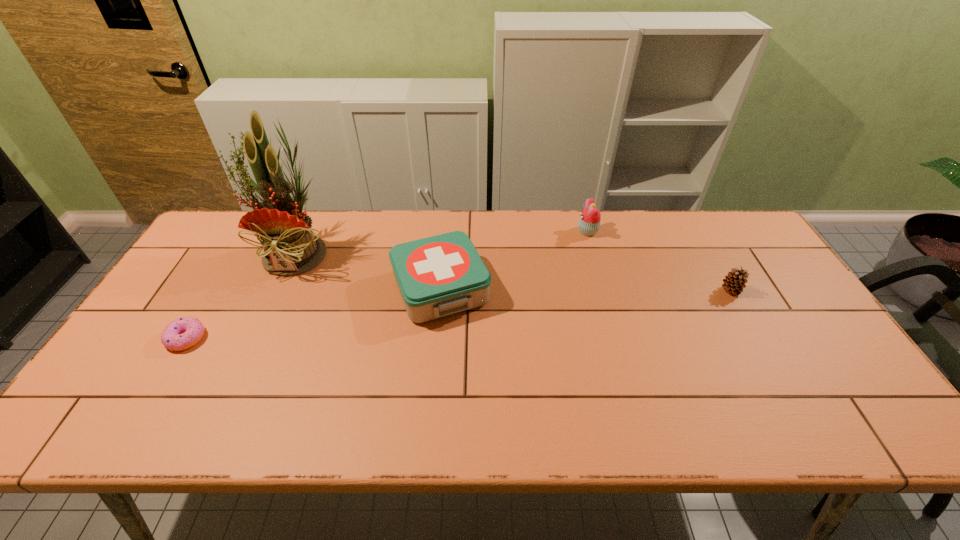
Identify the location of the fourth object from right to left. (291, 248).

Identify the location of flower arrangement. Image resolution: width=960 pixels, height=540 pixels. (291, 248).

Find the location of `cupcake`. cupcake is located at coordinates (589, 223).

Where is `the third object from right to left`? The width and height of the screenshot is (960, 540). the third object from right to left is located at coordinates (437, 276).

The image size is (960, 540). What are the coordinates of `the rightmost object` in the screenshot? It's located at (736, 279).

Find the location of a particular element. Image resolution: width=960 pixels, height=540 pixels. doughnut is located at coordinates (182, 333).

Locate an element on the screen. Image resolution: width=960 pixels, height=540 pixels. the leftmost object is located at coordinates (182, 333).

At what (x,y) coordinates should I click in order to perform the action: click on vacant space situated 0.400m in front of the flower arrangement with the fan visible. Please return your answer as a coordinate pair (x, y). The width and height of the screenshot is (960, 540). Looking at the image, I should click on (229, 404).

Locate an element on the screen. The image size is (960, 540). blank area located 0.340m on the face of the fourth object from left to right is located at coordinates [474, 231].

You are a GUI agent. You are given a task and a screenshot of the screen. Output one action in this format:
    pyautogui.click(x=<x>, y=<y>)
    Task: Click on the free region located 0.140m on the face of the fourth object from left to right
    The width and height of the screenshot is (960, 540).
    Given the screenshot: What is the action you would take?
    pyautogui.click(x=535, y=231)